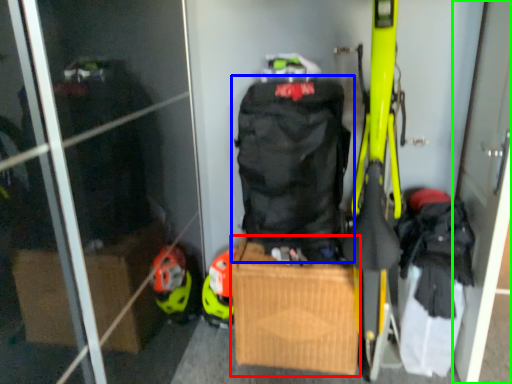
Question: Which object is the closest to the cardboard box (highlighted by a red box)? Choose among these: backpack (highlighted by a blue box) or screen door (highlighted by a green box).

Choices:
 (A) backpack
 (B) screen door

Answer: (A)